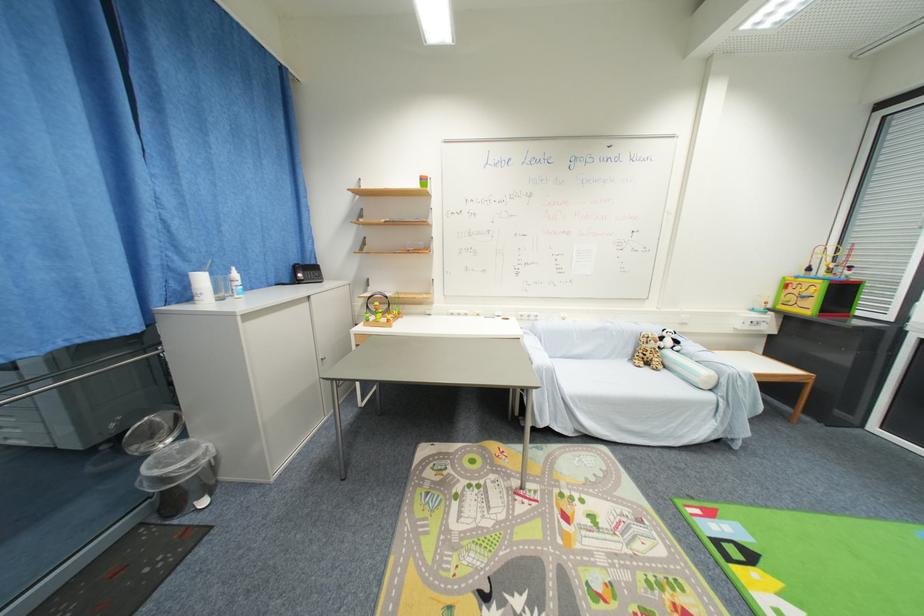
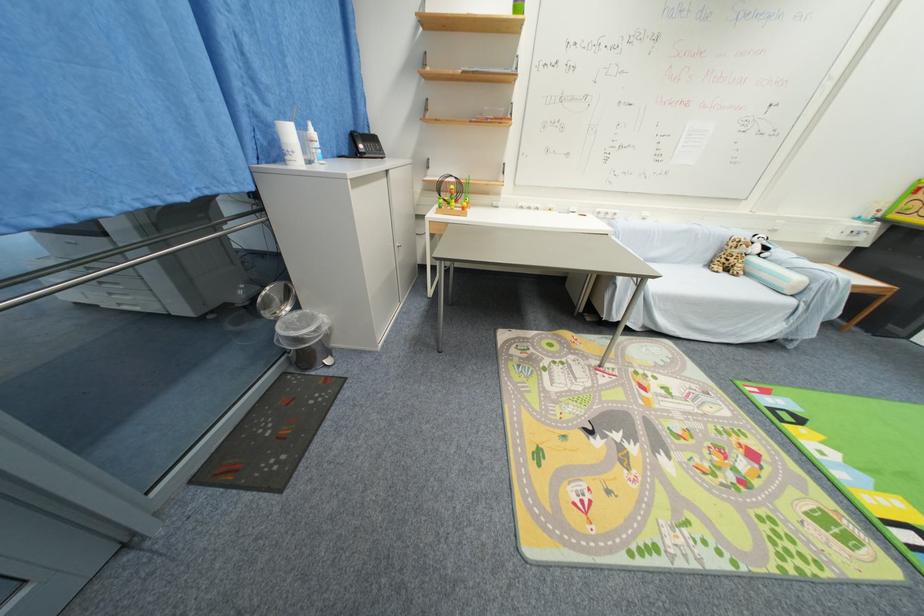
Find the pixel in the second image that matches [188,438] in the first image.

(301, 309)